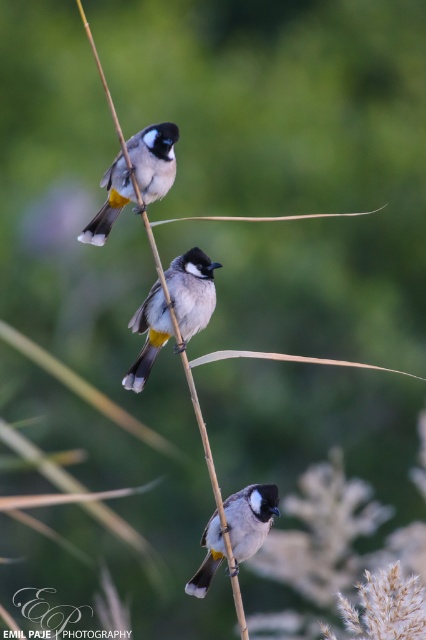
You are standing in the marsh area looking at the three birds on the reed. There are two points marked on the reed. Which point is closer to you, point (189,250) or point (112,168)?

Point (112,168) is closer to you because it is less further than point (189,250).